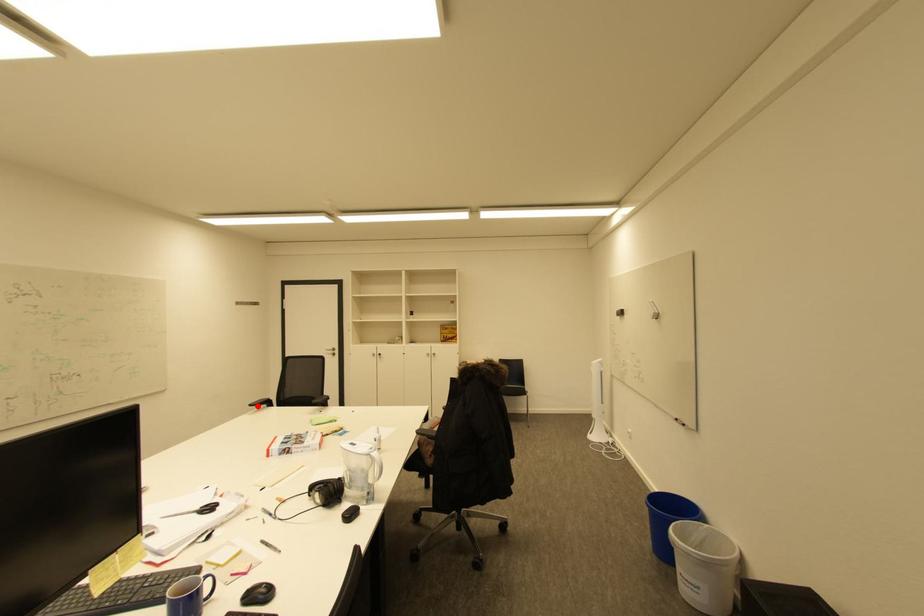
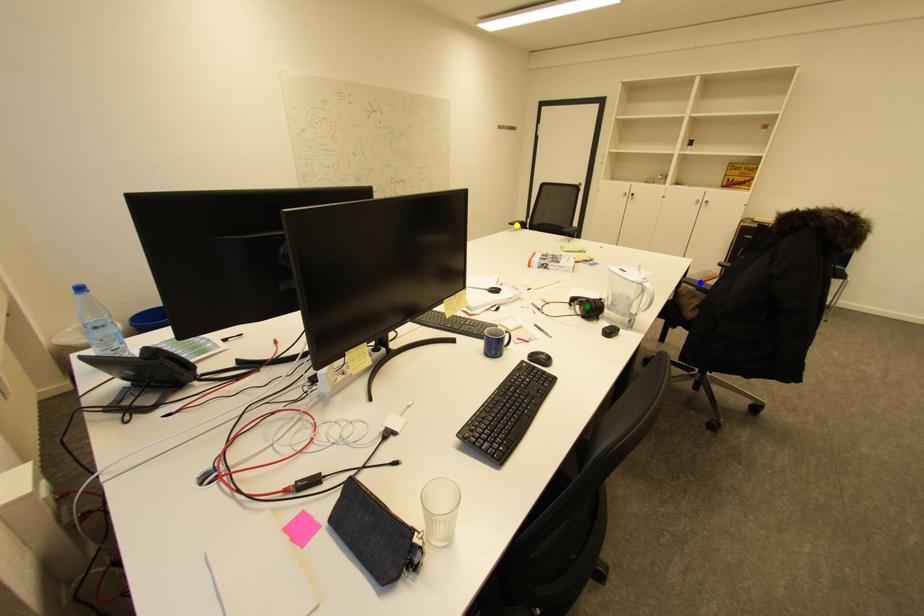
Question: I am providing you with two images of the same scene from different viewpoints. A red point is marked on the first image. You are given multiple points on the second image. Which mark in image 2 goes with the point in image 1?

Choices:
 (A) blue point
 (B) green point
 (C) yellow point

Answer: (C)